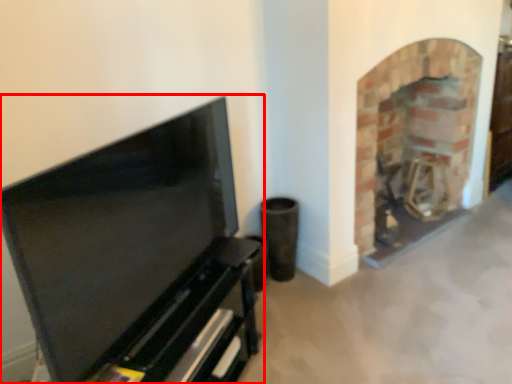
Question: From the image's perspective, where is entertainment center (annotated by the red box) located relative to fireplace?

Choices:
 (A) below
 (B) above

Answer: (A)